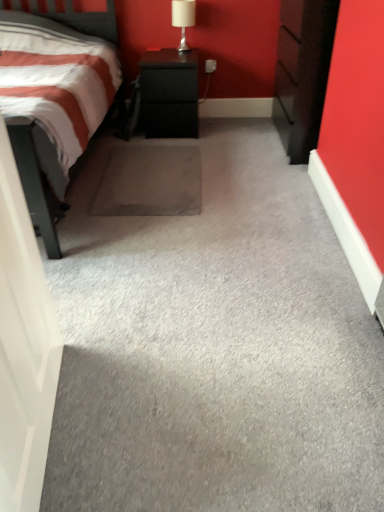
Describe the element at coordinates (23, 347) in the screenshot. I see `white glossy door at left` at that location.

Find the location of `white glossy table lamp at upper center`. white glossy table lamp at upper center is located at coordinates (183, 19).

Identify the location of gray carpet at center. This screenshot has width=384, height=512. (214, 347).

What do you see at coordinates (303, 72) in the screenshot? This screenshot has height=512, width=384. I see `dark wood chest of drawers at right` at bounding box center [303, 72].

Where is `white glossy door at left`? This screenshot has height=512, width=384. white glossy door at left is located at coordinates coord(23,347).

Considering the relative sizes of gray carpet at center and white glossy door at left in the image provided, is gray carpet at center wider than white glossy door at left?

Yes.

From a real-world perspective, is gray carpet at center located beneath white glossy door at left?

Yes, from a real-world perspective, gray carpet at center is under white glossy door at left.

Is gray carpet at center oriented away from white glossy door at left?

That's not correct — gray carpet at center is not looking away from white glossy door at left.

How much distance is there between gray carpet at center and white glossy door at left?

They are 50.96 centimeters apart.

Would you say white glossy table lamp at upper center is to the left or to the right of white glossy door at left in the picture?

white glossy table lamp at upper center is to the right of white glossy door at left.

Considering the sizes of objects white glossy table lamp at upper center and white glossy door at left in the image provided, who is smaller, white glossy table lamp at upper center or white glossy door at left?

white glossy table lamp at upper center.

Can you tell me how much white glossy table lamp at upper center and white glossy door at left differ in facing direction?

99.7 degrees.

Is white glossy door at left at the back of dark wood chest of drawers at right?

dark wood chest of drawers at right does not have its back to white glossy door at left.

Between dark wood chest of drawers at right and white glossy door at left, which one has smaller size?

white glossy door at left.

Is point (288, 99) more distant than point (10, 246)?

Yes, it is.

Considering the positions of objects dark wood chest of drawers at right and white glossy door at left in the image provided, who is behind, dark wood chest of drawers at right or white glossy door at left?

dark wood chest of drawers at right is further away from the camera.

Considering the relative positions of gray carpet at center and white glossy table lamp at upper center in the image provided, is gray carpet at center to the right of white glossy table lamp at upper center from the viewer's perspective?

Indeed, gray carpet at center is positioned on the right side of white glossy table lamp at upper center.

From the image's perspective, between gray carpet at center and white glossy table lamp at upper center, who is located below?

gray carpet at center, from the image's perspective.

Is gray carpet at center wider or thinner than white glossy table lamp at upper center?

gray carpet at center is wider than white glossy table lamp at upper center.

From a real-world perspective, does gray carpet at center sit lower than white glossy table lamp at upper center?

Yes, from a real-world perspective, gray carpet at center is below white glossy table lamp at upper center.

In terms of height, does white glossy door at left look taller or shorter compared to dark wood chest of drawers at right?

Clearly, white glossy door at left is taller compared to dark wood chest of drawers at right.

Is white glossy door at left in contact with dark wood chest of drawers at right?

white glossy door at left and dark wood chest of drawers at right are clearly separated.

From the image's perspective, relative to dark wood chest of drawers at right, is white glossy door at left above or below?

white glossy door at left is situated lower than dark wood chest of drawers at right in the image.

Could you tell me if white glossy door at left is turned towards dark wood chest of drawers at right?

No, white glossy door at left does not turn towards dark wood chest of drawers at right.

From a real-world perspective, does gray carpet at center sit lower than dark wood chest of drawers at right?

Yes, from a real-world perspective, gray carpet at center is below dark wood chest of drawers at right.

From the picture: Would you say gray carpet at center is outside dark wood chest of drawers at right?

gray carpet at center lies outside dark wood chest of drawers at right's area.

Can you confirm if gray carpet at center is positioned to the left of dark wood chest of drawers at right?

Correct, you'll find gray carpet at center to the left of dark wood chest of drawers at right.

Which of these two, gray carpet at center or dark wood chest of drawers at right, is wider?

gray carpet at center is wider.

Does white glossy door at left turn towards black textured cabinet at center?

No, white glossy door at left is not facing towards black textured cabinet at center.

Is white glossy door at left bigger or smaller than black textured cabinet at center?

Clearly, white glossy door at left is smaller in size than black textured cabinet at center.

What's the angular difference between white glossy door at left and black textured cabinet at center's facing directions?

The angular difference between white glossy door at left and black textured cabinet at center is 99.7 degrees.

Are white glossy door at left and black textured cabinet at center located far from each other?

Yes, white glossy door at left is far from black textured cabinet at center.

Locate an element on the screen. The image size is (384, 512). door on the left of gray carpet at center is located at coordinates (23, 347).

Where is `table lamp above the white glossy door at left (from a real-world perspective)`? Image resolution: width=384 pixels, height=512 pixels. table lamp above the white glossy door at left (from a real-world perspective) is located at coordinates (183, 19).

When comparing their distances from white glossy table lamp at upper center, does white glossy door at left or black textured cabinet at center seem further?

Among the two, white glossy door at left is located further to white glossy table lamp at upper center.

Looking at this image, looking at the image, which one is located further to black textured cabinet at center, dark wood chest of drawers at right or white glossy door at left?

Among the two, white glossy door at left is located further to black textured cabinet at center.

Based on their spatial positions, is dark wood chest of drawers at right or gray carpet at center closer to white glossy door at left?

gray carpet at center is positioned closer to the anchor white glossy door at left.

Estimate the real-world distances between objects in this image. Which object is closer to dark wood chest of drawers at right, white glossy door at left or black textured cabinet at center?

black textured cabinet at center lies closer to dark wood chest of drawers at right than the other object.

Estimate the real-world distances between objects in this image. Which object is closer to gray carpet at center, white glossy table lamp at upper center or white glossy door at left?

white glossy door at left is positioned closer to the anchor gray carpet at center.

When comparing their distances from dark wood chest of drawers at right, does white glossy door at left or white glossy table lamp at upper center seem closer?

white glossy table lamp at upper center is closer to dark wood chest of drawers at right.

Estimate the real-world distances between objects in this image. Which object is further from white glossy door at left, dark wood chest of drawers at right or black textured cabinet at center?

Among the two, black textured cabinet at center is located further to white glossy door at left.

Considering their positions, is black textured cabinet at center positioned closer to white glossy table lamp at upper center than dark wood chest of drawers at right?

black textured cabinet at center is positioned closer to the anchor white glossy table lamp at upper center.

Where is `chest of drawers between gray carpet at center and white glossy table lamp at upper center from front to back`? chest of drawers between gray carpet at center and white glossy table lamp at upper center from front to back is located at coordinates (303, 72).

Find the location of a particular element. nightstand between gray carpet at center and white glossy table lamp at upper center in the front-back direction is located at coordinates (169, 94).

Identify the location of the chest of drawers positioned between white glossy door at left and black textured cabinet at center from near to far. The width and height of the screenshot is (384, 512). (303, 72).

This screenshot has height=512, width=384. I want to click on concrete between white glossy door at left and dark wood chest of drawers at right in the front-back direction, so click(214, 347).